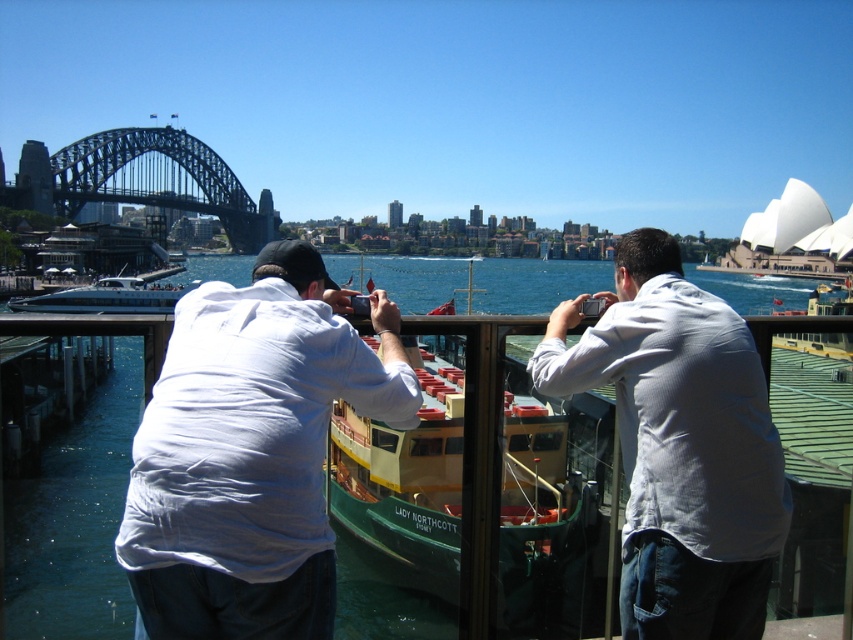
You are a photographer trying to capture the entire Sydney Harbour Bridge and the Opera House in one shot. Given the blue water at center and the white glossy ferry at lower left are both in your frame, can you fit both landmarks without cropping either?

The blue water at center is larger than the white glossy ferry at lower left, so you can fit both landmarks in the frame without cropping either as the water occupies more space.

You are standing at the railing with the two people in the scene. You want to take a photo of the blue water at center without the light blue shirt at center blocking the view. Is it possible? Explain why.

The light blue shirt at center is closer to the viewer than the blue water at center. Therefore, the light blue shirt at center will block the view of the blue water at center, making it impossible to take a photo without obstruction.